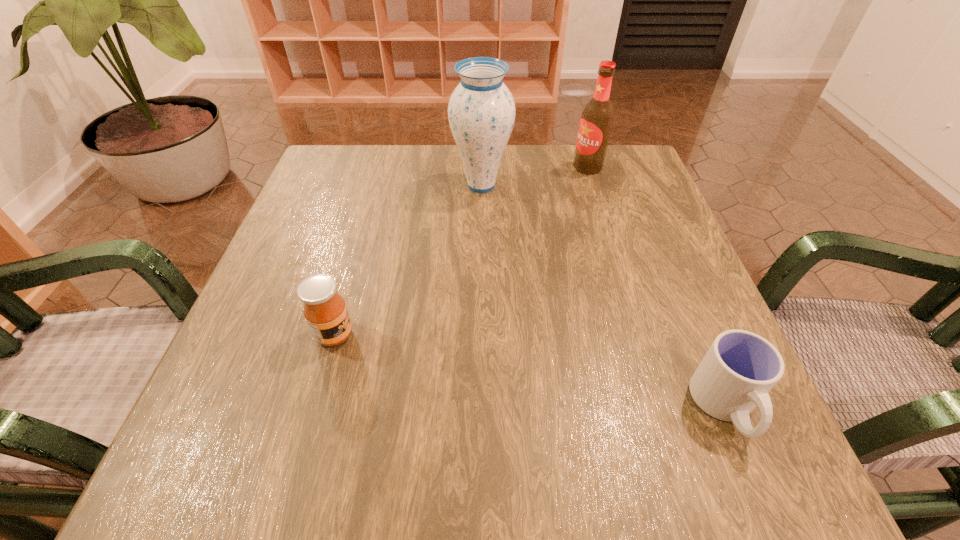
This screenshot has width=960, height=540. Identify the location of beer bottle that is at the far edge. (597, 117).

Identify the location of object that is at the near edge. (739, 369).

Where is `object that is at the left edge`? This screenshot has height=540, width=960. object that is at the left edge is located at coordinates (325, 311).

Locate an element on the screen. The width and height of the screenshot is (960, 540). beer bottle present at the right edge is located at coordinates (597, 117).

This screenshot has height=540, width=960. I want to click on cup that is at the right edge, so click(x=739, y=369).

You are a GUI agent. You are given a task and a screenshot of the screen. Output one action in this format:
    pyautogui.click(x=<x>, y=<y>)
    Task: Click on the object situated at the far right corner
    The height and width of the screenshot is (540, 960).
    Given the screenshot: What is the action you would take?
    pyautogui.click(x=597, y=117)

Where is `object that is at the near right corner`? The height and width of the screenshot is (540, 960). object that is at the near right corner is located at coordinates (739, 369).

The width and height of the screenshot is (960, 540). I want to click on vacant space at the far edge, so pos(506,184).

Where is `vacant area at the left edge of the desktop`? The width and height of the screenshot is (960, 540). vacant area at the left edge of the desktop is located at coordinates (221, 375).

This screenshot has width=960, height=540. Find the location of `free space at the right edge of the desktop`. free space at the right edge of the desktop is located at coordinates (609, 244).